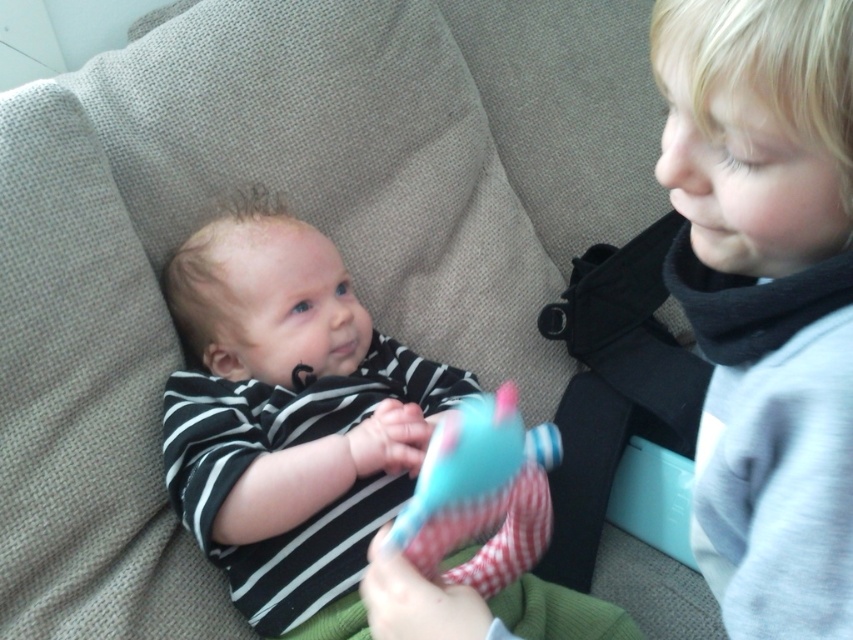
Question: Does striped fabric baby at center have a lesser width compared to plush cotton toy at center?

Choices:
 (A) no
 (B) yes

Answer: (A)

Question: Which point is farther to the camera?

Choices:
 (A) plush cotton toy at center
 (B) striped fabric baby at center

Answer: (B)

Question: Can you confirm if smooth gray sweater at right is positioned above plush cotton toy at center?

Choices:
 (A) yes
 (B) no

Answer: (A)

Question: Is smooth gray sweater at right positioned behind striped fabric baby at center?

Choices:
 (A) yes
 (B) no

Answer: (B)

Question: Which object appears farthest from the camera in this image?

Choices:
 (A) striped fabric baby at center
 (B) smooth gray sweater at right

Answer: (A)

Question: Which of the following is the farthest from the observer?

Choices:
 (A) (817, 524)
 (B) (252, 477)

Answer: (B)